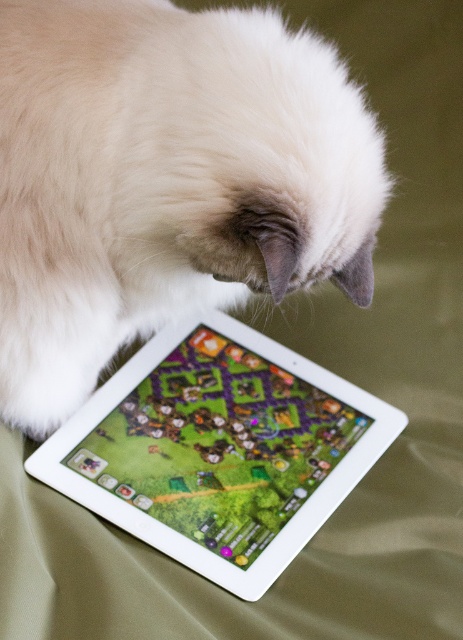
Who is positioned more to the right, white fluffy cat at center or white glossy tablet at upper center?

white glossy tablet at upper center is more to the right.

Consider the image. Between white fluffy cat at center and white glossy tablet at upper center, which one has less height?

white glossy tablet at upper center is shorter.

You are a GUI agent. You are given a task and a screenshot of the screen. Output one action in this format:
    pyautogui.click(x=<x>, y=<y>)
    Task: Click on the white fluffy cat at center
    
    Given the screenshot: What is the action you would take?
    pyautogui.click(x=164, y=180)